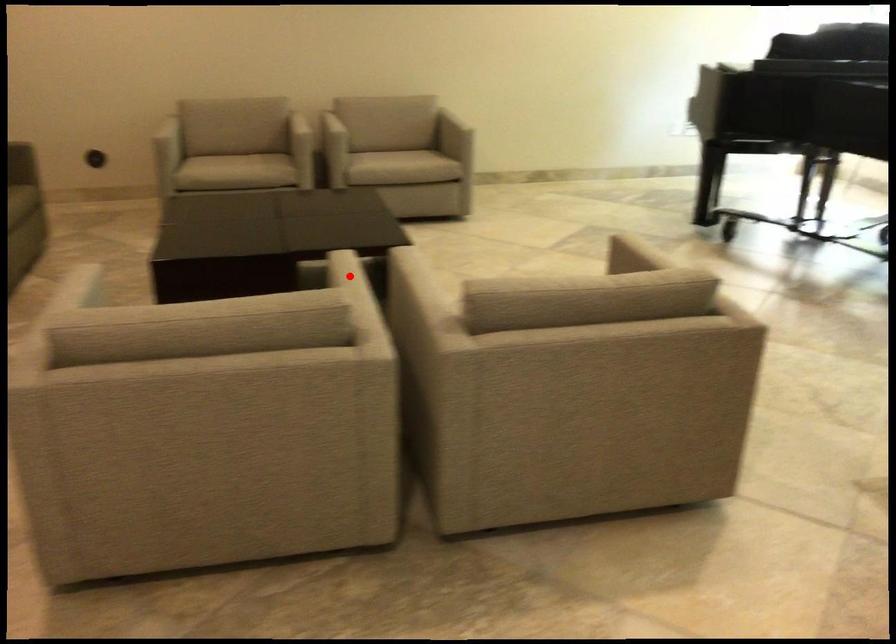
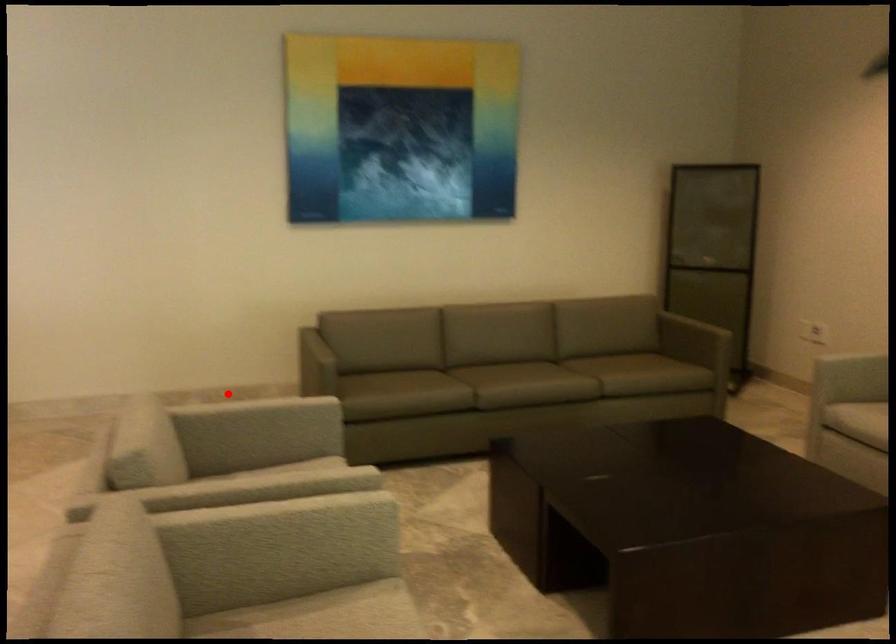
Looking at this image, I am providing you with two images of the same scene from different viewpoints. A red point is marked on the first image and another point is marked on the second image. Is the red point in image1 aligned with the point shown in image2?

No